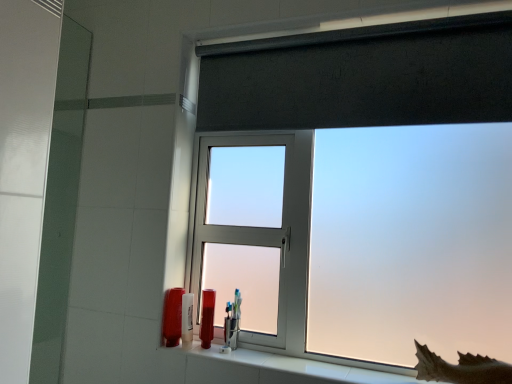
Question: Is translucent plastic tube at lower center, the 3th toiletry viewed from the left, oriented towards matte glass screen door at left?

Choices:
 (A) yes
 (B) no

Answer: (B)

Question: From a real-world perspective, is translucent plastic tube at lower center, marked as the second toiletry in a right-to-left arrangement, beneath matte glass screen door at left?

Choices:
 (A) yes
 (B) no

Answer: (A)

Question: Considering the relative sizes of translucent plastic tube at lower center, marked as the second toiletry in a right-to-left arrangement, and matte glass screen door at left in the image provided, is translucent plastic tube at lower center, marked as the second toiletry in a right-to-left arrangement, shorter than matte glass screen door at left?

Choices:
 (A) yes
 (B) no

Answer: (A)

Question: Is translucent plastic tube at lower center, marked as the second toiletry in a right-to-left arrangement, wider than matte glass screen door at left?

Choices:
 (A) yes
 (B) no

Answer: (A)

Question: Can we say translucent plastic tube at lower center, the 3th toiletry viewed from the left, lies outside matte glass screen door at left?

Choices:
 (A) yes
 (B) no

Answer: (A)

Question: In terms of size, does matte plastic toothbrush at lower left, arranged as the 4th toiletry when viewed from the right, appear bigger or smaller than frosted plastic shark fin at lower right?

Choices:
 (A) big
 (B) small

Answer: (B)

Question: Would you say matte plastic toothbrush at lower left, which ranks as the 1th toiletry in left-to-right order, is inside or outside frosted plastic shark fin at lower right?

Choices:
 (A) inside
 (B) outside

Answer: (B)

Question: From the image's perspective, is matte plastic toothbrush at lower left, arranged as the 4th toiletry when viewed from the right, located above or below frosted plastic shark fin at lower right?

Choices:
 (A) above
 (B) below

Answer: (A)

Question: Does point (162, 329) appear closer or farther from the camera than point (489, 374)?

Choices:
 (A) farther
 (B) closer

Answer: (A)

Question: From the image's perspective, is translucent plastic toothbrush at lower center, which appears as the third toiletry when viewed from the right, positioned above or below matte glass screen door at left?

Choices:
 (A) below
 (B) above

Answer: (A)

Question: Relative to matte glass screen door at left, is translucent plastic toothbrush at lower center, which appears as the third toiletry when viewed from the right, in front or behind?

Choices:
 (A) front
 (B) behind

Answer: (B)

Question: Is translucent plastic toothbrush at lower center, the second toiletry when ordered from left to right, bigger or smaller than matte glass screen door at left?

Choices:
 (A) small
 (B) big

Answer: (A)

Question: Considering the positions of translucent plastic toothbrush at lower center, which appears as the third toiletry when viewed from the right, and matte glass screen door at left in the image, is translucent plastic toothbrush at lower center, which appears as the third toiletry when viewed from the right, wider or thinner than matte glass screen door at left?

Choices:
 (A) wide
 (B) thin

Answer: (A)

Question: From a real-world perspective, relative to frosted glass window at upper center, is clear plastic toothbrush holder at center, the fourth toiletry when ordered from left to right, vertically above or below?

Choices:
 (A) above
 (B) below

Answer: (B)

Question: From the image's perspective, relative to frosted glass window at upper center, is clear plastic toothbrush holder at center, the fourth toiletry when ordered from left to right, above or below?

Choices:
 (A) above
 (B) below

Answer: (B)